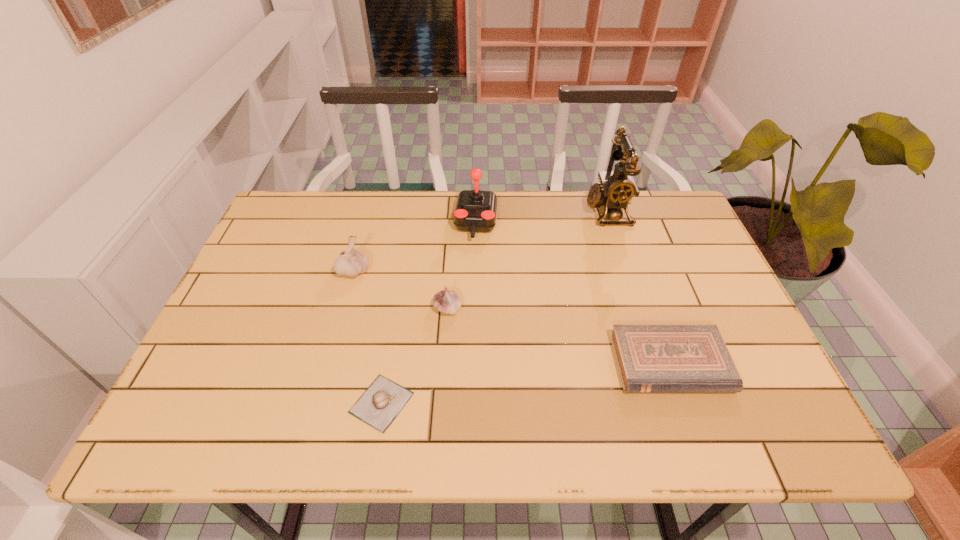
Identify the location of free space located on the rotary dial of the tallest object. The height and width of the screenshot is (540, 960). (x=520, y=211).

Locate an element on the screen. vacant area situated on the rotary dial of the tallest object is located at coordinates (511, 211).

The width and height of the screenshot is (960, 540). What are the coordinates of `free space located on the front of the joystick` in the screenshot? It's located at (476, 270).

This screenshot has height=540, width=960. I want to click on vacant space located 0.280m on the right of the third tallest object, so click(474, 271).

Find the location of a particular element. The width and height of the screenshot is (960, 540). blank area located on the right of the second tallest garlic is located at coordinates (482, 308).

The image size is (960, 540). In order to click on free space located on the spine side of the fifth tallest object in this screenshot , I will do `click(691, 423)`.

Image resolution: width=960 pixels, height=540 pixels. What are the coordinates of `vacant area situated 0.050m on the left of the nearest garlic` in the screenshot? It's located at (325, 403).

Locate an element on the screen. telephone that is positioned at the far edge is located at coordinates (616, 189).

Image resolution: width=960 pixels, height=540 pixels. I want to click on joystick that is at the far edge, so click(476, 211).

The width and height of the screenshot is (960, 540). Identify the location of object located at the near edge. (383, 400).